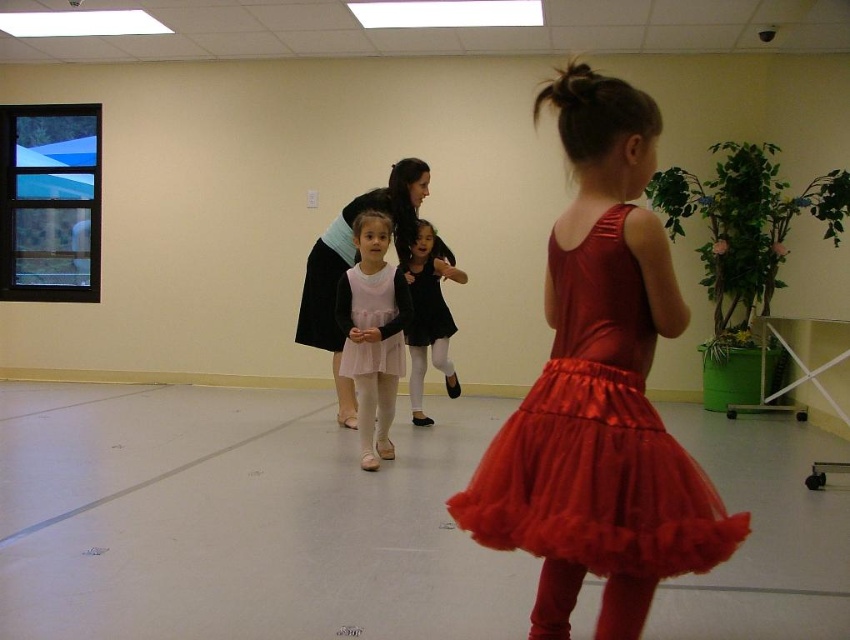
Question: Among these objects, which one is nearest to the camera?

Choices:
 (A) pink satin dress at center
 (B) pink satin tutu at center
 (C) shiny red tulle skirt at center

Answer: (C)

Question: Can you confirm if pink satin tutu at center is positioned to the left of pink satin dress at center?

Choices:
 (A) yes
 (B) no

Answer: (B)

Question: Can you confirm if shiny red tulle skirt at center is positioned to the right of black satin dress at center?

Choices:
 (A) no
 (B) yes

Answer: (B)

Question: Which point is closer to the camera taking this photo?

Choices:
 (A) (462, 508)
 (B) (361, 202)

Answer: (A)

Question: Does pink satin dress at center have a smaller size compared to black satin dress at center?

Choices:
 (A) yes
 (B) no

Answer: (B)

Question: Which object is positioned closest to the pink satin tutu at center?

Choices:
 (A) shiny red tulle skirt at center
 (B) black satin dress at center

Answer: (B)